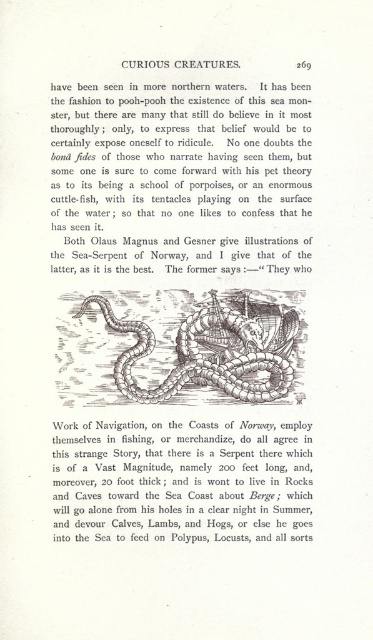
Question: Can you confirm if black paper text at center is bigger than grayish-brown scaly snake at center?

Choices:
 (A) no
 (B) yes

Answer: (B)

Question: Is matte paper text at upper center in front of black paper text at center?

Choices:
 (A) no
 (B) yes

Answer: (B)

Question: Does black paper text at center appear under grayish-brown scaly snake at center?

Choices:
 (A) no
 (B) yes

Answer: (B)

Question: Which is farther from the grayish-brown scaly snake at center?

Choices:
 (A) black paper text at center
 (B) matte paper text at upper center

Answer: (B)

Question: Which object is positioned closest to the black paper text at center?

Choices:
 (A) grayish-brown scaly snake at center
 (B) matte paper text at upper center

Answer: (A)

Question: Which object appears closest to the camera in this image?

Choices:
 (A) matte paper text at upper center
 (B) grayish-brown scaly snake at center

Answer: (A)